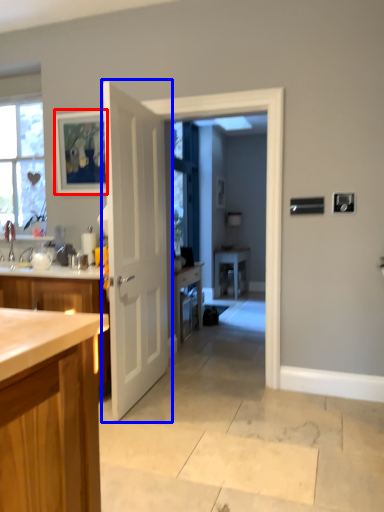
Question: Which object appears farthest to the camera in this image, picture frame (highlighted by a red box) or door (highlighted by a blue box)?

Choices:
 (A) picture frame
 (B) door

Answer: (A)